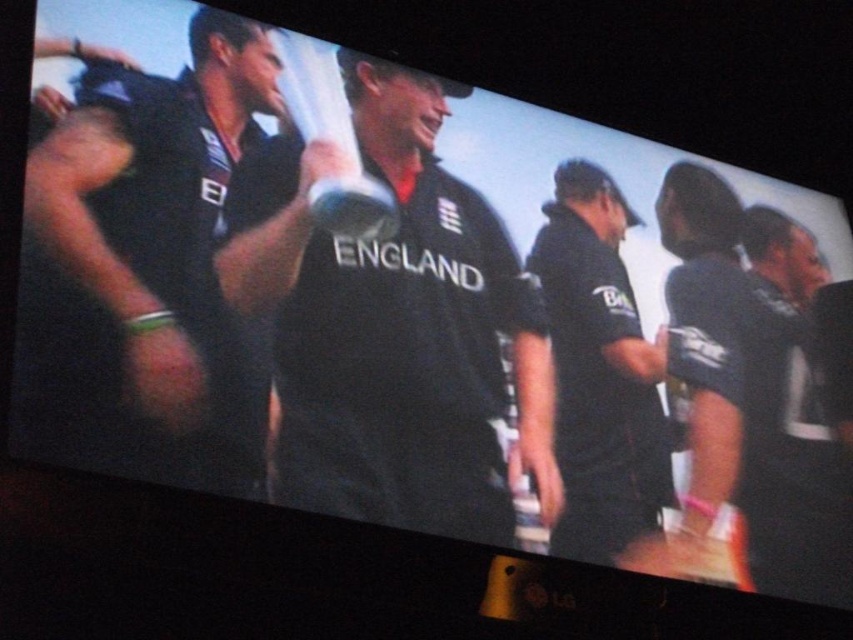
You are a sports photographer who needs to ensure all team members are visible in a group photo. You notice two players wearing the matte black shirt at left and the black matte shirt at right. Which shirt should you focus on to capture both players clearly in the photo?

The matte black shirt at left has a larger size compared to the black matte shirt at right, so focusing on the matte black shirt at left would help capture both players clearly as it is more visible due to its larger size.

You are a photographer trying to capture the trophy held by the player in the center of the image. The camera you are using has a focus point at coordinate point (392, 326). According to the scene, will the focus point land on the trophy or the black matte shirt at center?

The point (392, 326) is on black matte shirt at center, so the focus point will land on the black matte shirt at center instead of the trophy.

From the picture: You are a photographer standing in front of the TV screen. You need to capture a photo of both the black matte shirt at center and the black matte shirt at right. Which shirt should you focus on first to ensure both are in frame?

You should focus on the black matte shirt at center first because it is much taller than the black matte shirt at right, so it will take up more space in the frame and needs to be centered properly to include both shirts.